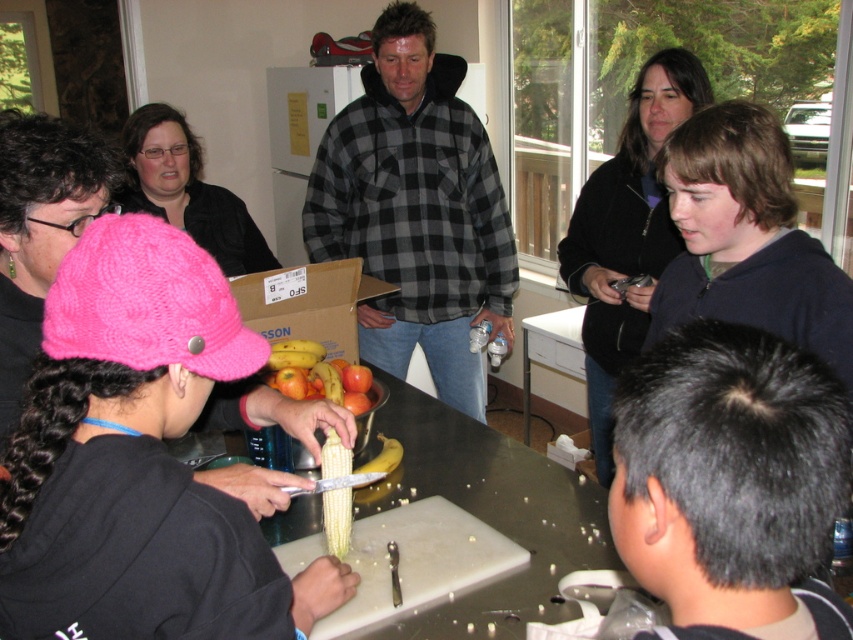
Can you confirm if black checkered shirt at center is positioned below yellow matte banana at center?

Incorrect, black checkered shirt at center is not positioned below yellow matte banana at center.

Is point (486, 243) positioned after point (376, 468)?

Yes, it is.

The width and height of the screenshot is (853, 640). Find the location of `black checkered shirt at center`. black checkered shirt at center is located at coordinates (416, 209).

Is dark gray hair at lower right thinner than dark blue hoodie at right?

Indeed, dark gray hair at lower right has a lesser width compared to dark blue hoodie at right.

Is dark gray hair at lower right smaller than dark blue hoodie at right?

Yes.

Is point (691, 500) positioned before point (751, 305)?

Yes.

What are the coordinates of `dark gray hair at lower right` in the screenshot? It's located at (729, 481).

Measure the distance between black checkered shirt at center and dark blue hoodie at right.

black checkered shirt at center is 3.65 feet from dark blue hoodie at right.

Who is shorter, black checkered shirt at center or dark blue hoodie at right?

With less height is dark blue hoodie at right.

Which is in front, point (431, 355) or point (773, 184)?

Positioned in front is point (773, 184).

This screenshot has height=640, width=853. Find the location of `black checkered shirt at center`. black checkered shirt at center is located at coordinates (416, 209).